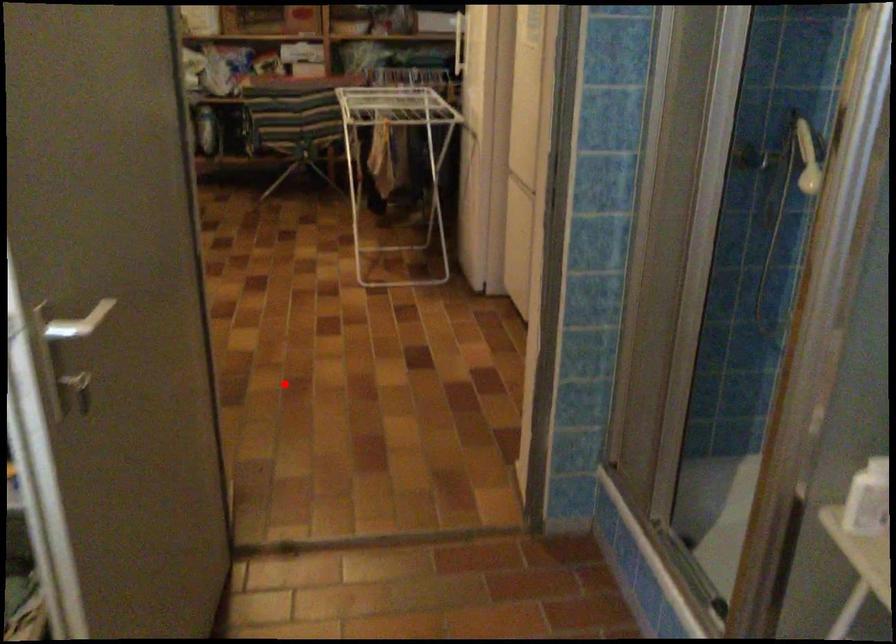
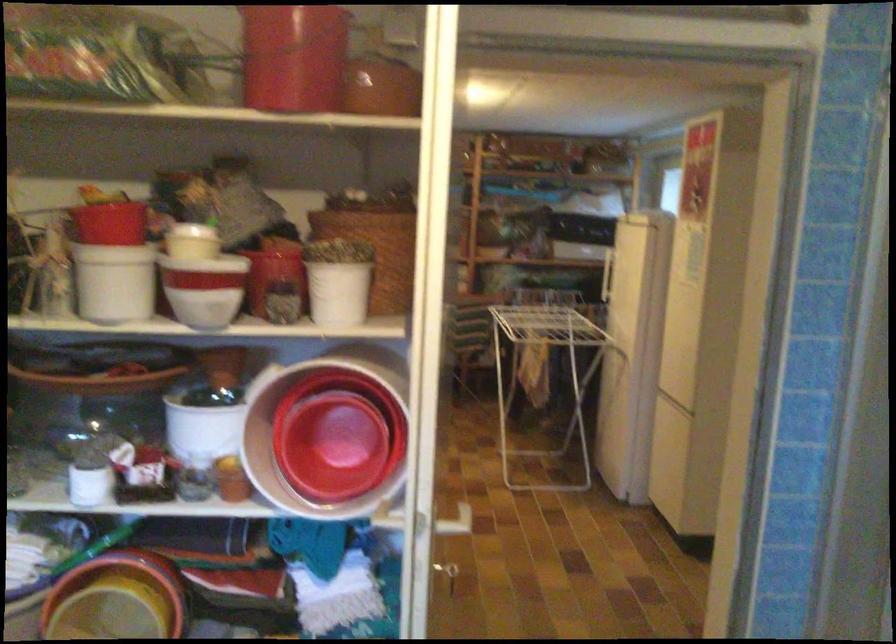
Locate, in the second image, the point that corresponds to the highlighted location in the first image.

(449, 574)